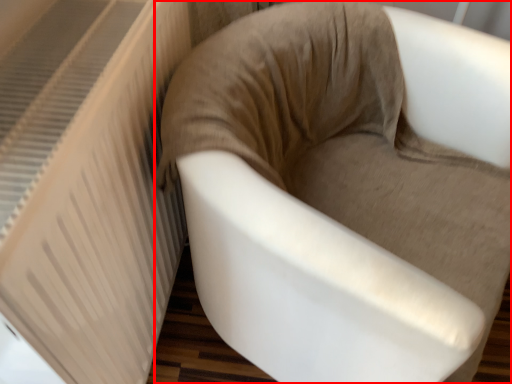
Question: From the image, what is the correct spatial relationship of chair (annotated by the red box) in relation to radiator?

Choices:
 (A) left
 (B) right

Answer: (B)